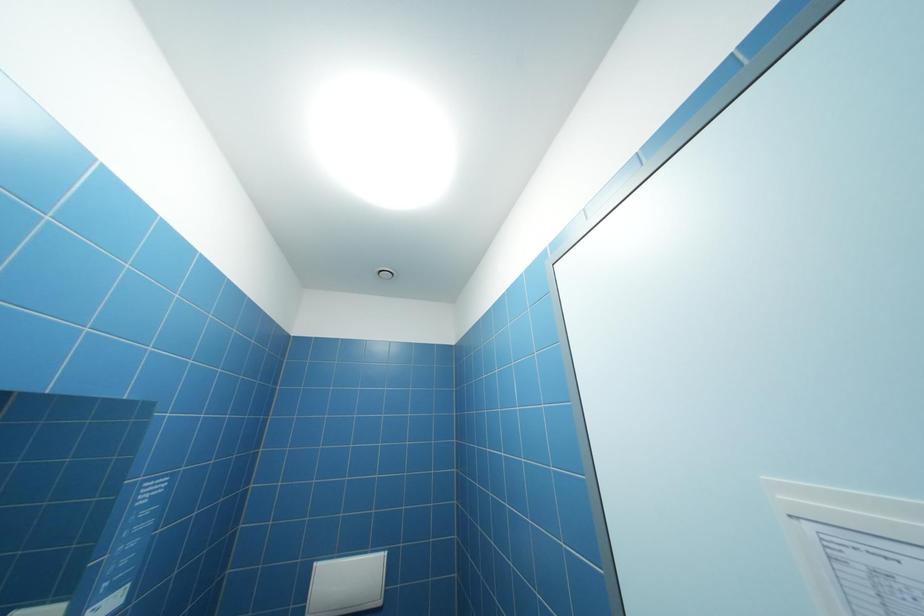
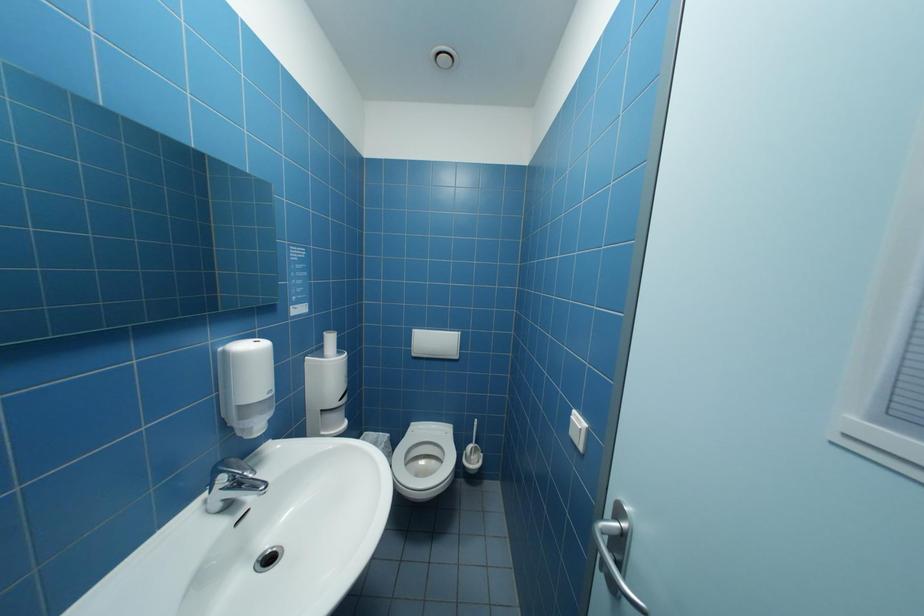
The images are taken continuously from a first-person perspective. In which direction is your viewpoint rotating?

The camera's rotation is toward left-down.